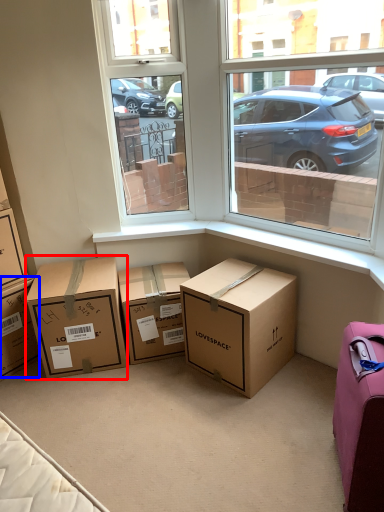
Question: Among these objects, which one is farthest to the camera, box (highlighted by a red box) or box (highlighted by a blue box)?

Choices:
 (A) box
 (B) box

Answer: (B)